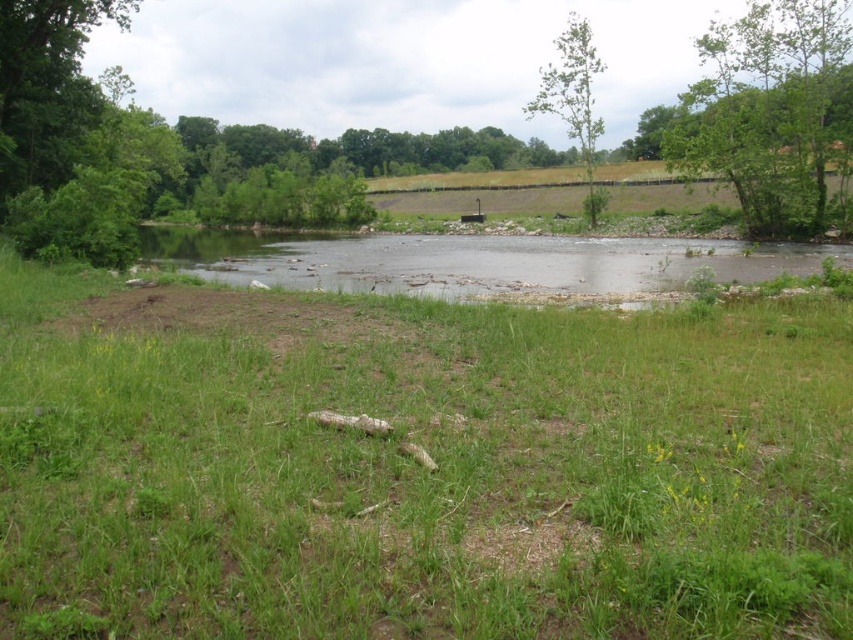
Between green leafy tree at upper right and green leafy tree at upper center, which one appears on the left side from the viewer's perspective?

green leafy tree at upper center is more to the left.

Where is `green leafy tree at upper right`? green leafy tree at upper right is located at coordinates (764, 112).

Does green grassy at center have a lesser height compared to clear water at center?

Correct, green grassy at center is not as tall as clear water at center.

Who is more distant from viewer, (277, 492) or (381, 260)?

Point (381, 260)

You are a GUI agent. You are given a task and a screenshot of the screen. Output one action in this format:
    pyautogui.click(x=<x>, y=<y>)
    Task: Click on the green grassy at center
    The image size is (853, 640).
    Given the screenshot: What is the action you would take?
    pyautogui.click(x=416, y=467)

Does green grassy at center appear over green leafy tree at upper right?

No.

Does point (421, 531) lie in front of point (798, 173)?

Yes, it is.

The image size is (853, 640). In order to click on green grassy at center in this screenshot , I will do `click(416, 467)`.